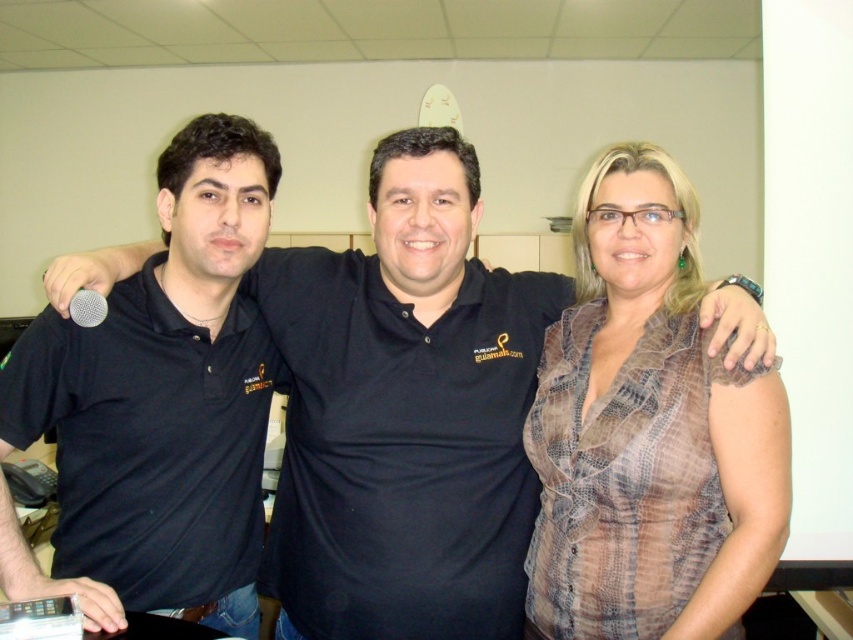
Question: Which of the following is the farthest from the observer?

Choices:
 (A) silver metallic microphone at left
 (B) black matte shirt at center
 (C) black matte shirt at left
 (D) plaid fabric blouse at center

Answer: (A)

Question: Does plaid fabric blouse at center have a smaller size compared to silver metallic microphone at lower left?

Choices:
 (A) no
 (B) yes

Answer: (A)

Question: From the image, what is the correct spatial relationship of black matte shirt at left in relation to silver metallic microphone at left?

Choices:
 (A) left
 (B) right

Answer: (B)

Question: Which of these objects is positioned closest to the silver metallic microphone at left?

Choices:
 (A) silver metallic microphone at lower left
 (B) black matte shirt at center

Answer: (A)

Question: Among these objects, which one is nearest to the camera?

Choices:
 (A) black matte shirt at left
 (B) black matte shirt at center
 (C) silver metallic microphone at left
 (D) plaid fabric blouse at center

Answer: (D)

Question: Does black matte shirt at left appear over silver metallic microphone at left?

Choices:
 (A) yes
 (B) no

Answer: (B)